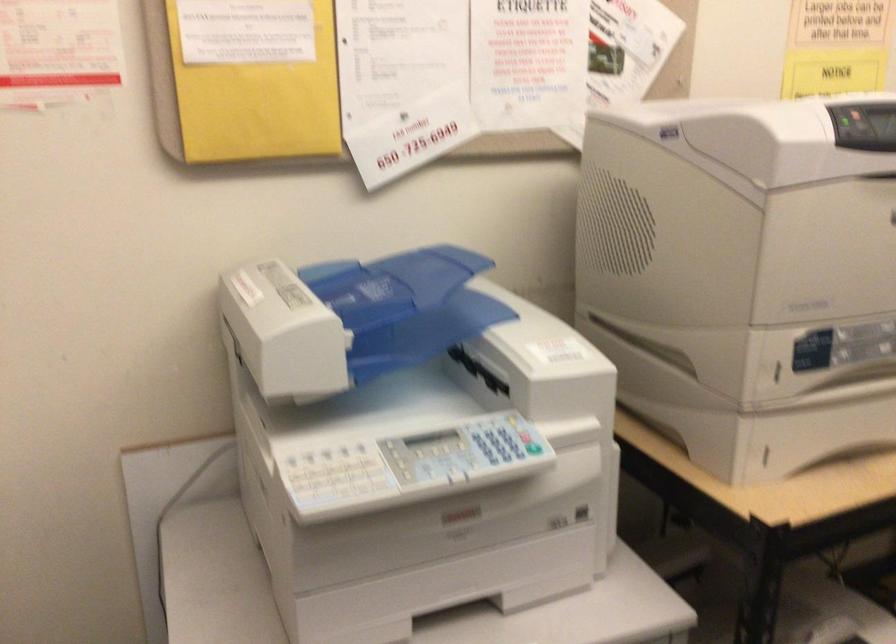
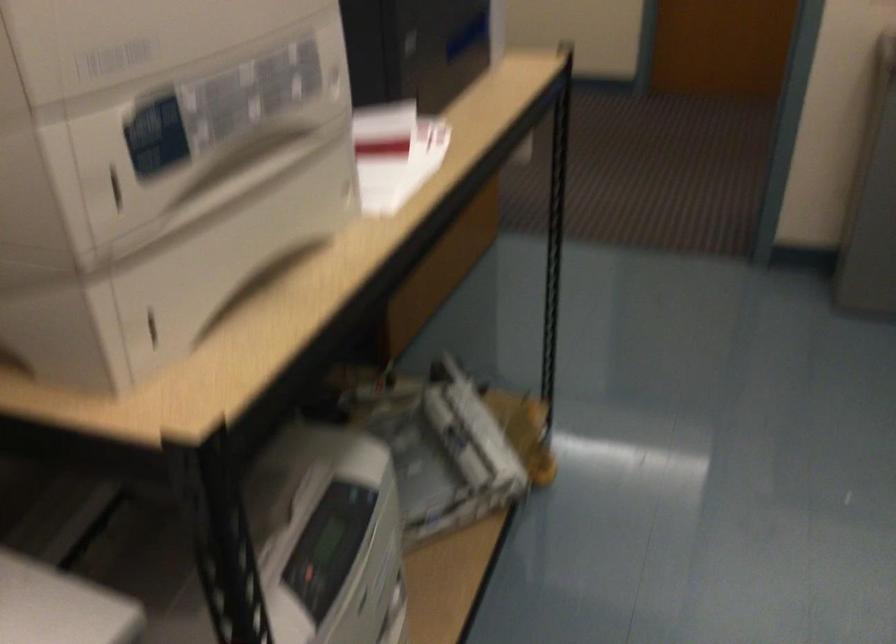
The point at (772, 372) is marked in the first image. Where is the corresponding point in the second image?

(116, 189)